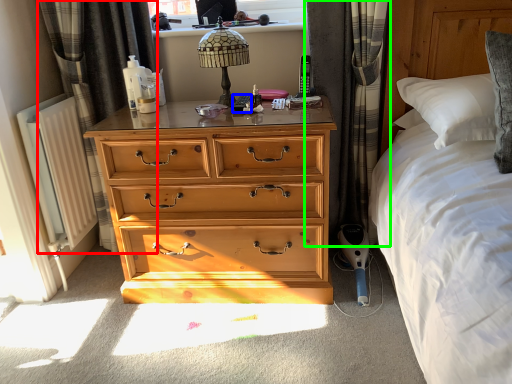
Question: Estimate the real-world distances between objects in this image. Which object is farther from curtain (highlighted by a red box), remote control (highlighted by a blue box) or curtain (highlighted by a green box)?

Choices:
 (A) remote control
 (B) curtain

Answer: (B)